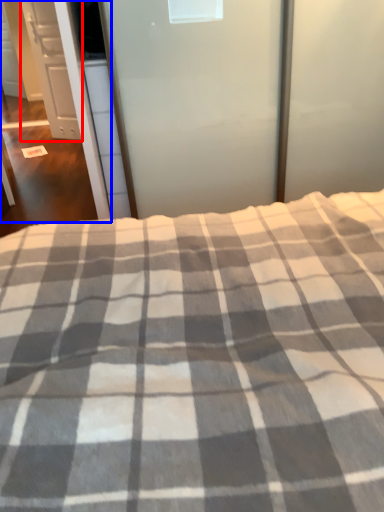
Question: Which object is closer to the camera taking this photo, cabinetry (highlighted by a red box) or screen door (highlighted by a blue box)?

Choices:
 (A) cabinetry
 (B) screen door

Answer: (B)